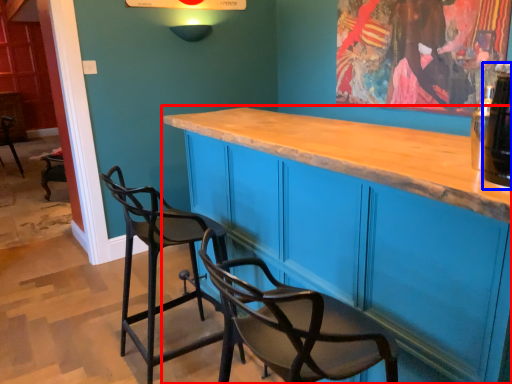
Question: Which object is closer to the camera taking this photo, cabinetry (highlighted by a red box) or beverage (highlighted by a blue box)?

Choices:
 (A) cabinetry
 (B) beverage

Answer: (A)